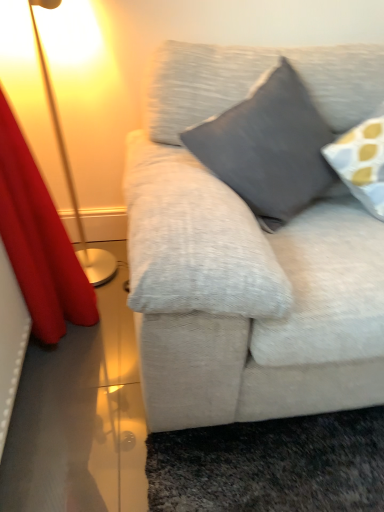
At what (x,y) coordinates should I click in order to perform the action: click on free space that is in between metallic gold lamp at left and red velvet curtain at left. Please return your answer as a coordinate pair (x, y). Looking at the image, I should click on (112, 325).